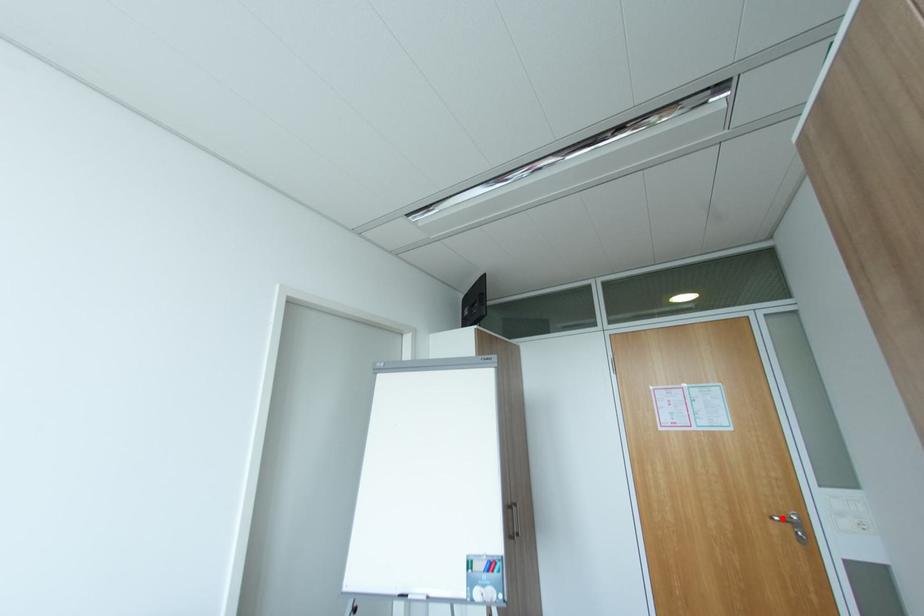
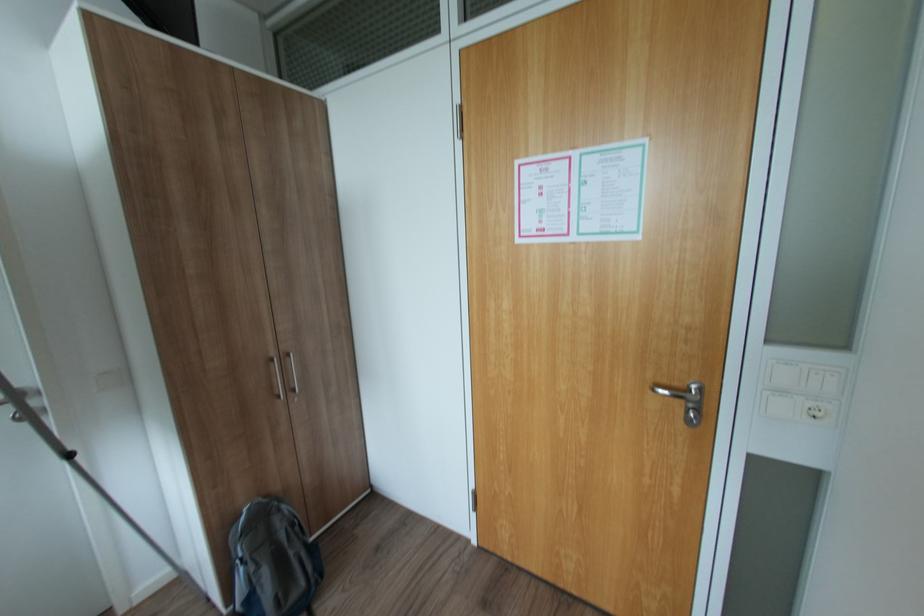
Find the pixel in the second image that matches the highlighted location in the first image.

(664, 390)